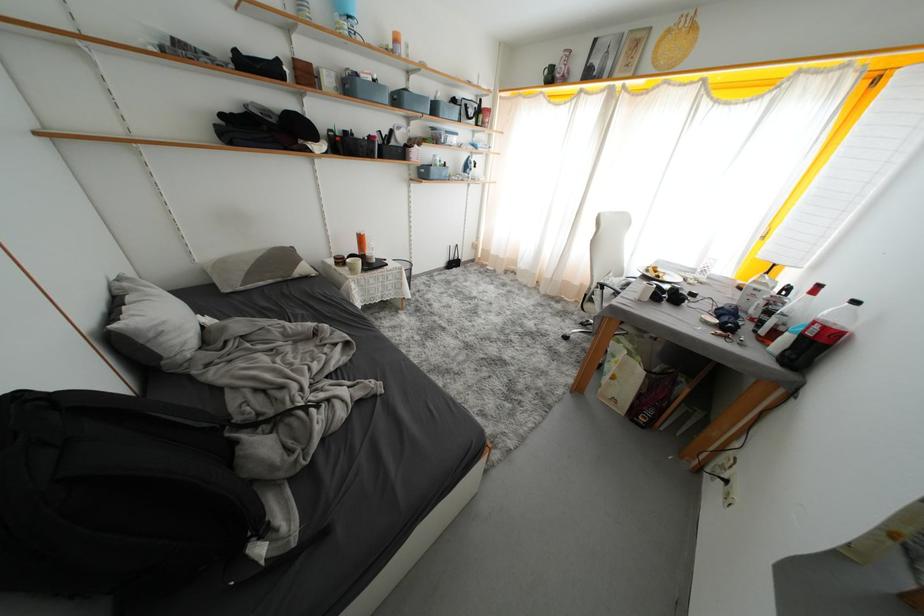
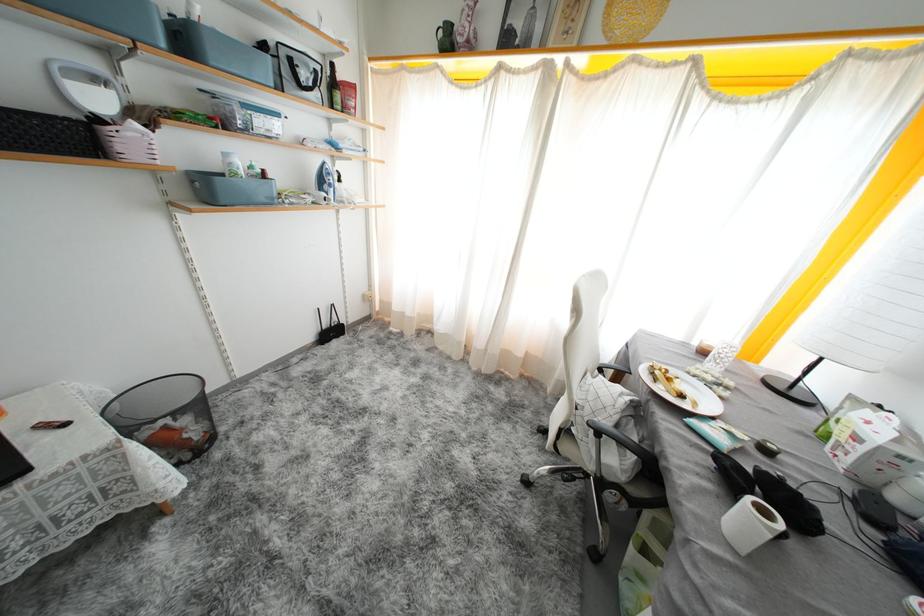
In the second image, find the point that corresponds to (441,113) in the first image.

(190, 44)